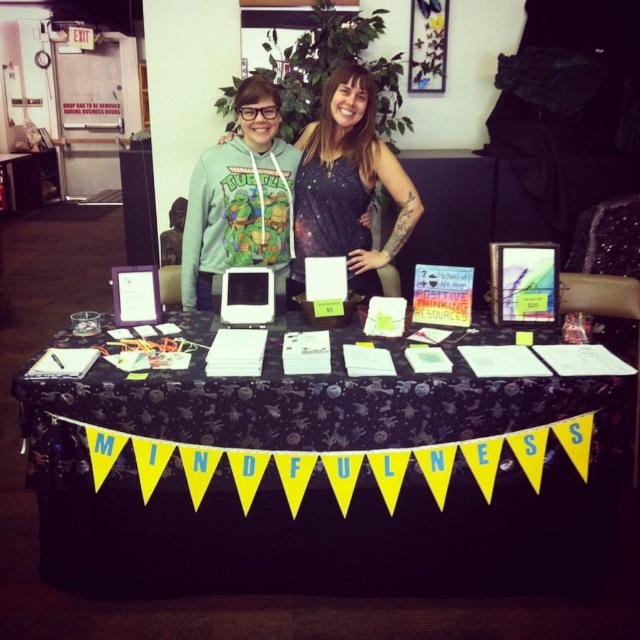
Question: Observing the image, what is the correct spatial positioning of black fabric table at center in reference to black galaxy print dress at center?

Choices:
 (A) right
 (B) left

Answer: (B)

Question: Which of the following is the farthest from the observer?

Choices:
 (A) (260, 572)
 (B) (352, 204)
 (C) (305, 250)

Answer: (C)

Question: Which of the following is the closest to the observer?

Choices:
 (A) black galaxy print dress at center
 (B) black fabric table at center
 (C) teal fabric hoodie at center

Answer: (B)

Question: Where is black fabric table at center located in relation to black galaxy print dress at center in the image?

Choices:
 (A) below
 (B) above

Answer: (A)

Question: Can you confirm if black fabric table at center is smaller than teal fabric hoodie at center?

Choices:
 (A) yes
 (B) no

Answer: (B)

Question: Estimate the real-world distances between objects in this image. Which object is closer to the black fabric table at center?

Choices:
 (A) teal fabric hoodie at center
 (B) black galaxy print dress at center

Answer: (B)